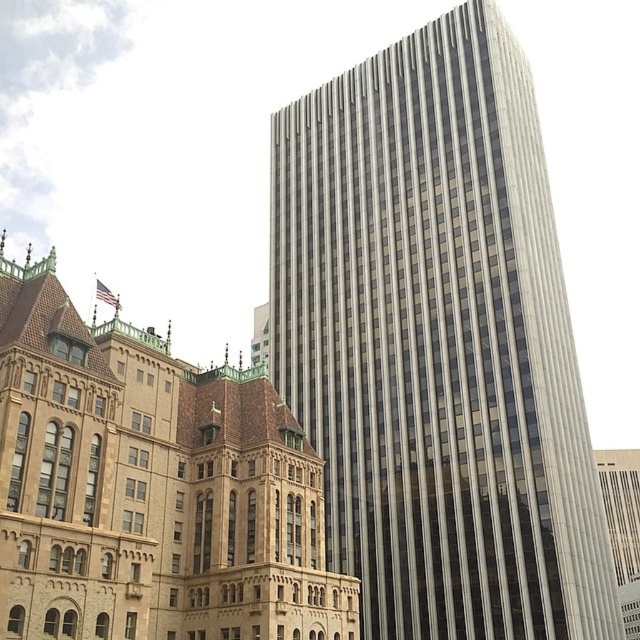
Question: Can you confirm if silver glass skyscraper at center is smaller than smooth glass skyscraper at center?

Choices:
 (A) no
 (B) yes

Answer: (A)

Question: Which of the following is the closest to the observer?

Choices:
 (A) (157, 449)
 (B) (532, 499)

Answer: (A)

Question: Can you confirm if silver glass skyscraper at center is thinner than smooth glass skyscraper at center?

Choices:
 (A) no
 (B) yes

Answer: (A)

Question: Which object appears farthest from the camera in this image?

Choices:
 (A) smooth glass skyscraper at center
 (B) silver glass skyscraper at center

Answer: (B)

Question: Is silver glass skyscraper at center wider than smooth glass skyscraper at center?

Choices:
 (A) yes
 (B) no

Answer: (A)

Question: Which point is farther to the camera?

Choices:
 (A) smooth glass skyscraper at center
 (B) silver glass skyscraper at center

Answer: (B)